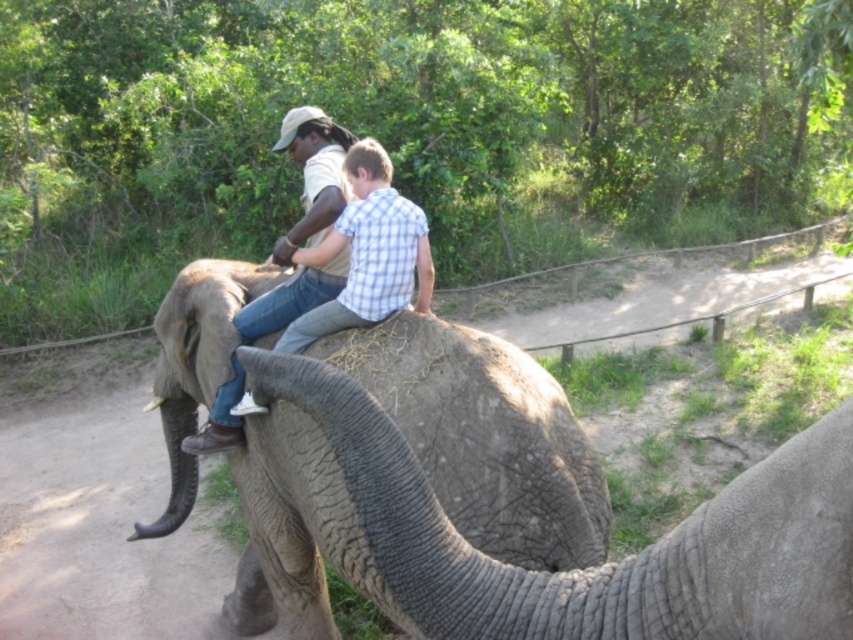
You are a photographer standing at a safe distance from the gray textured elephant at center and the matte khaki shirt at center. You want to capture a photo that includes both subjects without any obstruction. Given that your camera has a maximum focus range of 20 inches, can you take the photo from your current position?

The gray textured elephant at center is 23.25 inches away from the matte khaki shirt at center. Since the distance between them exceeds the camera maximum focus range of 20 inches, you cannot take the photo from your current position.

You are standing in front of the elephant and want to reach the point at coordinates (200,266). The elephant is between you and that point. Can you walk around the elephant to reach it?

The point at coordinates (200,266) is 13.48 feet away from the viewer. Since the elephant is between you and the point, you would need to move around the elephant to reach it, but the distance might require some maneuvering depending on the elephant and your path.

You are a photographer trying to capture the two riders on the elephant. You notice two points on the elephant, one at coordinates point (x=305, y=524) and another at point (x=270, y=291). Which point is closer to your camera lens?

Point (x=305, y=524) is closer to the camera lens than point (x=270, y=291) according to the description.